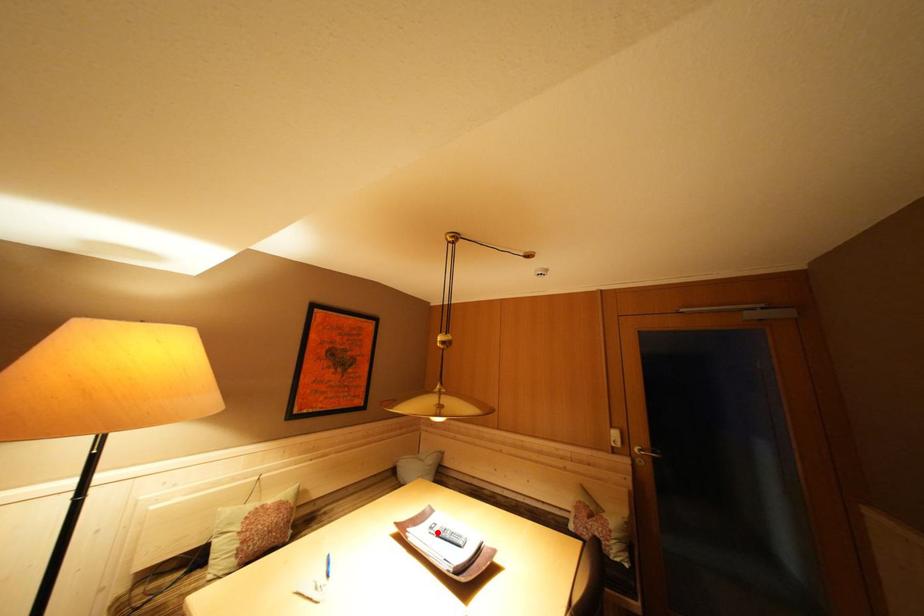
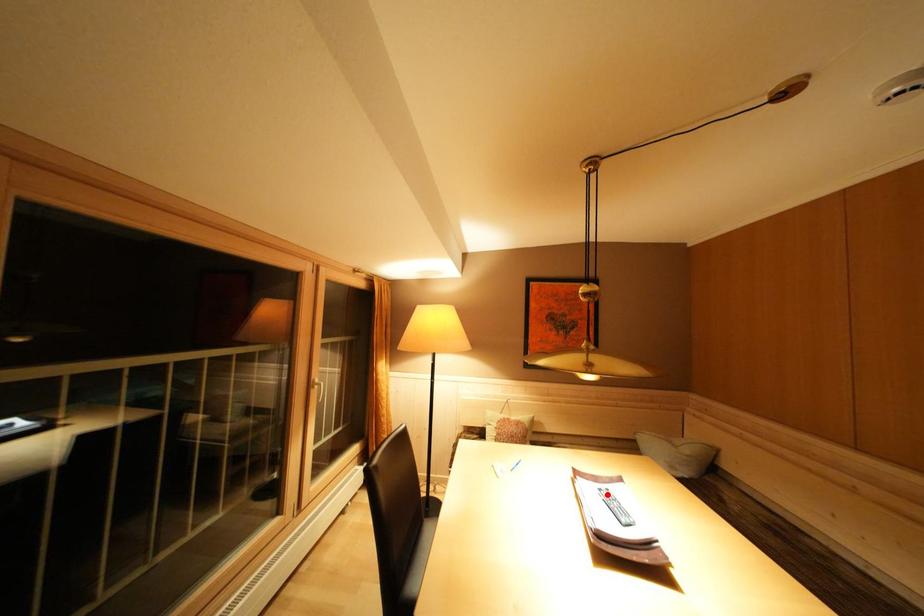
I am providing you with two images of the same scene from different viewpoints. A red point is marked on the first image and another point is marked on the second image. Is the red point in image1 aligned with the point shown in image2?

Yes